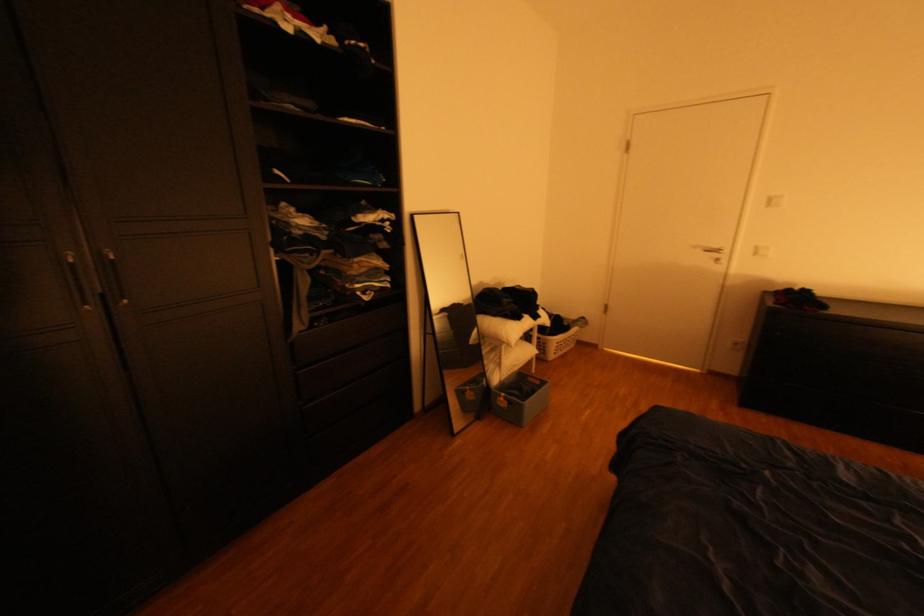
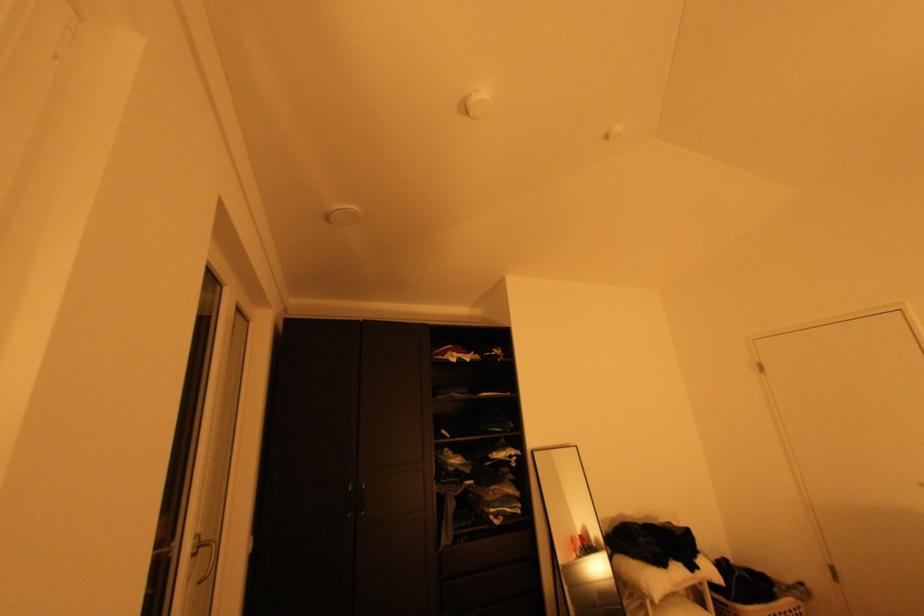
Based on the continuous images, in which direction is the camera rotating?

The camera's rotation is toward left-up.